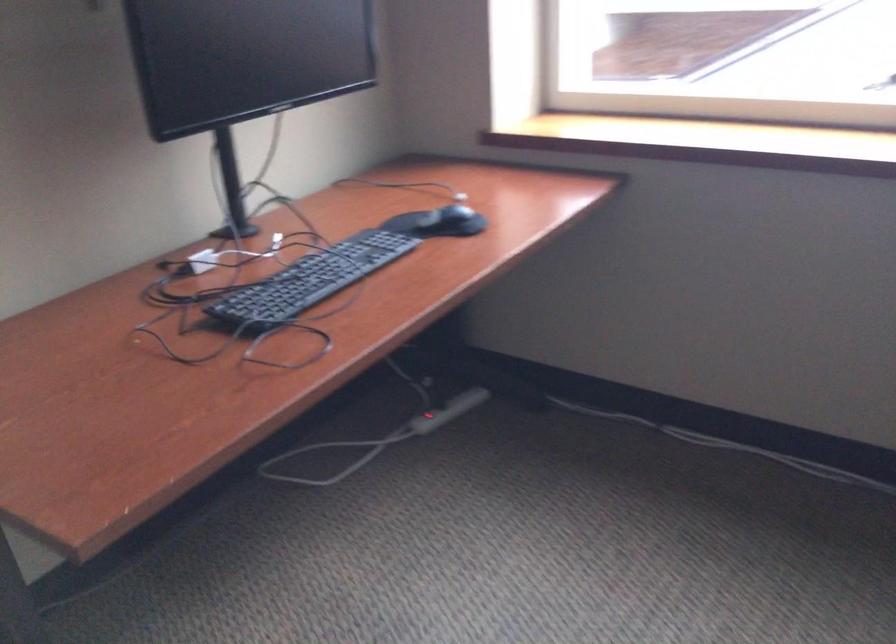
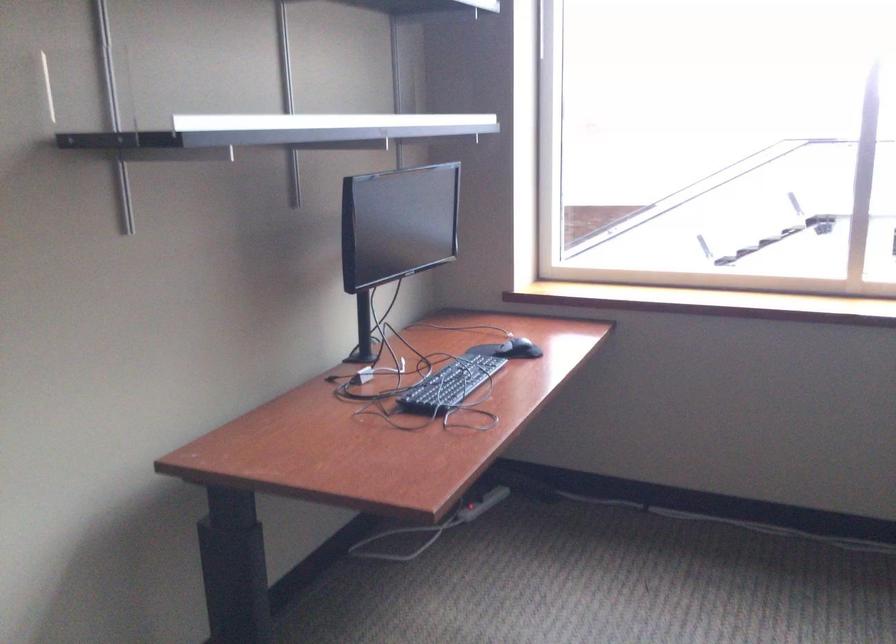
The images are taken continuously from a first-person perspective. In which direction are you moving?

The cameraman moved toward left, backward.